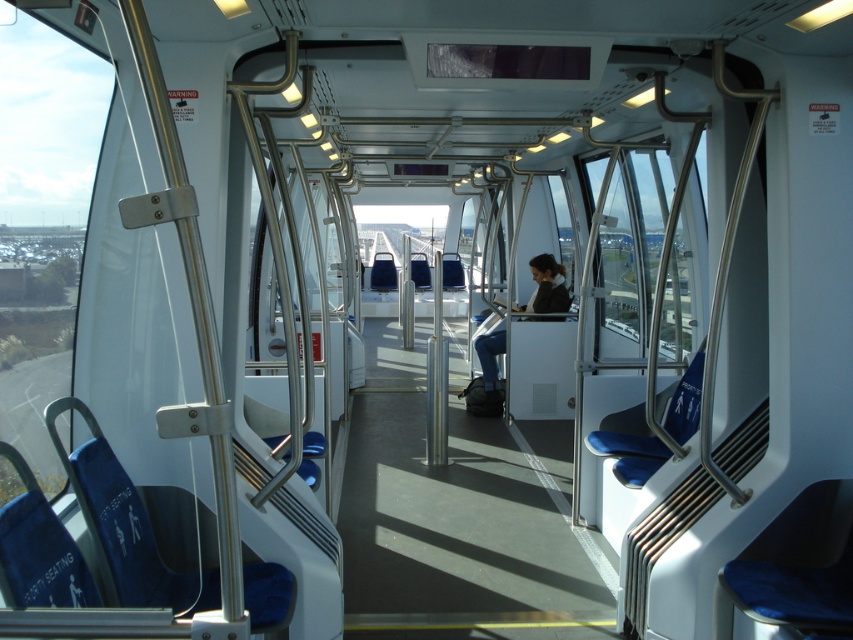
Question: Which object is farther from the camera taking this photo?

Choices:
 (A) clear glass window at center
 (B) transparent glass window at left

Answer: (A)

Question: Is clear glass window at center behind dark blue jeans at center?

Choices:
 (A) yes
 (B) no

Answer: (B)

Question: Is clear glass window at center bigger than dark blue jeans at center?

Choices:
 (A) no
 (B) yes

Answer: (B)

Question: Which of the following is the farthest from the observer?

Choices:
 (A) clear glass window at center
 (B) dark blue jeans at center
 (C) transparent glass window at left

Answer: (B)

Question: Which point is closer to the camera taking this photo?

Choices:
 (A) (555, 284)
 (B) (56, 381)
 (C) (636, 269)

Answer: (B)

Question: Is transparent glass window at left to the left of clear glass window at center from the viewer's perspective?

Choices:
 (A) no
 (B) yes

Answer: (B)